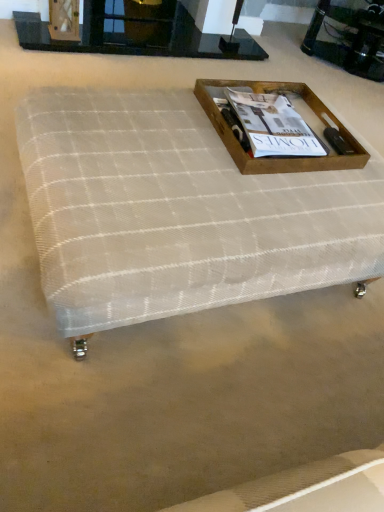
Question: Considering the positions of black glass fireplace at upper center and shiny black glass tray at upper right in the image, is black glass fireplace at upper center taller or shorter than shiny black glass tray at upper right?

Choices:
 (A) short
 (B) tall

Answer: (A)

Question: Looking at the image, does black glass fireplace at upper center seem bigger or smaller compared to shiny black glass tray at upper right?

Choices:
 (A) big
 (B) small

Answer: (B)

Question: Which of these objects is positioned closest to the white mesh ottoman at center?

Choices:
 (A) shiny black glass tray at upper right
 (B) wooden tray at center
 (C) black glass fireplace at upper center
 (D) matte brown wooden tray at upper center

Answer: (B)

Question: Estimate the real-world distances between objects in this image. Which object is farther from the black glass fireplace at upper center?

Choices:
 (A) shiny black glass tray at upper right
 (B) wooden tray at center
 (C) white mesh ottoman at center
 (D) matte brown wooden tray at upper center

Answer: (C)